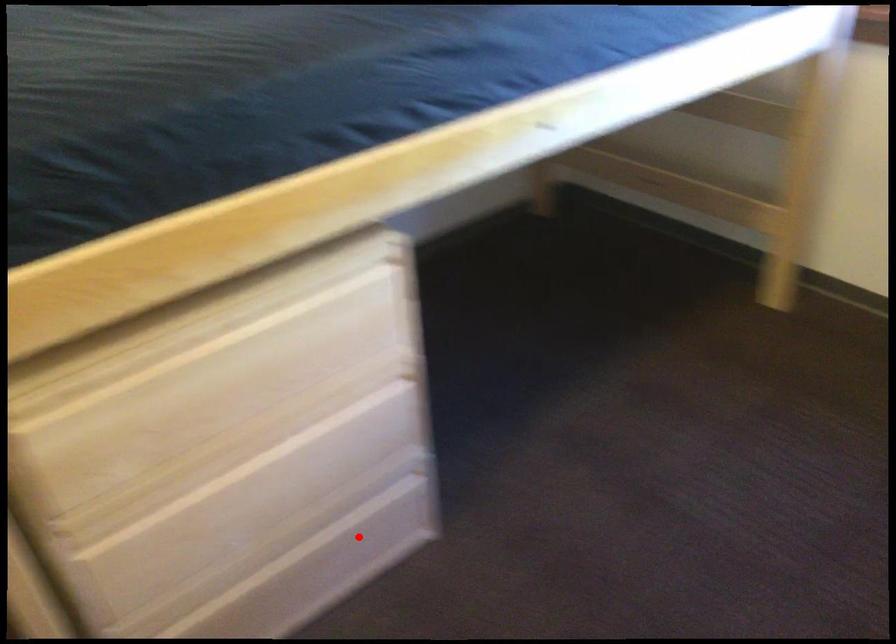
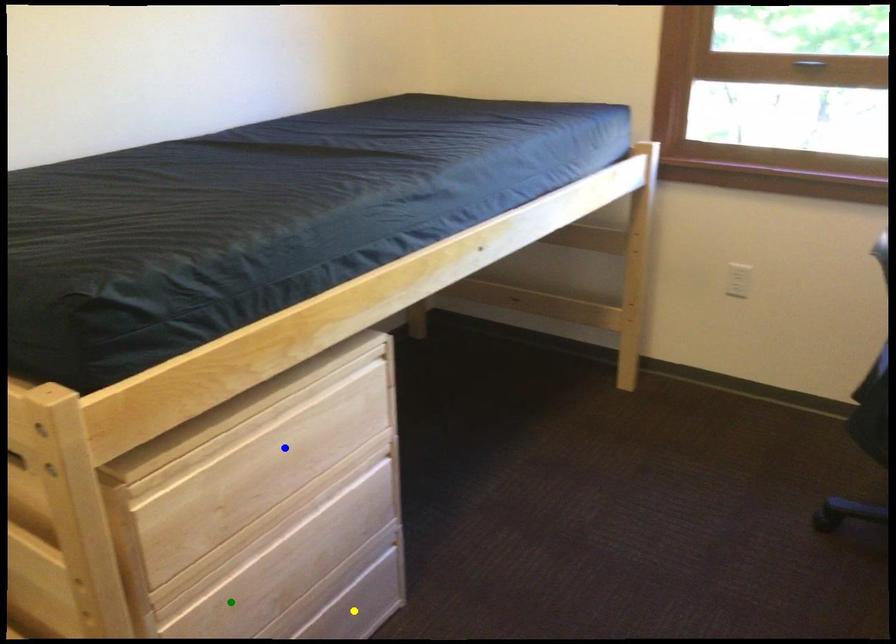
Question: I am providing you with two images of the same scene from different viewpoints. A red point is marked on the first image. You are given multiple points on the second image. Which mark in image 2 goes with the point in image 1?

Choices:
 (A) blue point
 (B) yellow point
 (C) green point

Answer: (B)